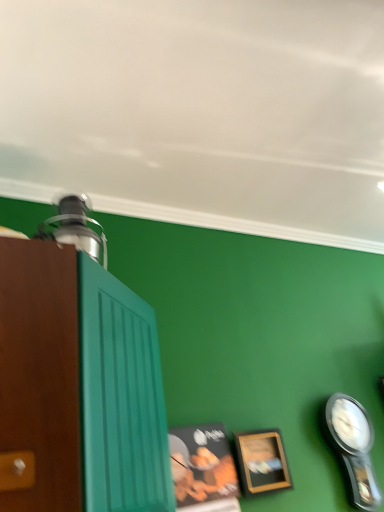
Locate an element on the screen. wooden picture frame at lower right, positioned as the second picture frame in left-to-right order is located at coordinates (262, 462).

Describe the element at coordinates (80, 384) in the screenshot. I see `brown wood cabinet at left` at that location.

What do you see at coordinates (354, 447) in the screenshot? Image resolution: width=384 pixels, height=512 pixels. I see `black plastic clock at lower right` at bounding box center [354, 447].

How much space does wooden picture frame at lower center, the first picture frame in the left-to-right sequence, occupy vertically?

wooden picture frame at lower center, the first picture frame in the left-to-right sequence, is 10.99 inches tall.

Identify the location of wooden picture frame at lower right, positioned as the second picture frame in left-to-right order. The height and width of the screenshot is (512, 384). (262, 462).

Does black plastic clock at lower right come in front of wooden picture frame at lower center, the first picture frame in the left-to-right sequence?

No, black plastic clock at lower right is further to the viewer.

Is black plastic clock at lower right to the left or to the right of wooden picture frame at lower center, the first picture frame in the left-to-right sequence, in the image?

black plastic clock at lower right is to the right of wooden picture frame at lower center, the first picture frame in the left-to-right sequence.

In terms of size, does black plastic clock at lower right appear bigger or smaller than wooden picture frame at lower center, the 2th picture frame in the right-to-left sequence?

black plastic clock at lower right is bigger than wooden picture frame at lower center, the 2th picture frame in the right-to-left sequence.

Would you say black plastic clock at lower right is outside wooden picture frame at lower center, the 2th picture frame in the right-to-left sequence?

black plastic clock at lower right lies outside wooden picture frame at lower center, the 2th picture frame in the right-to-left sequence,'s area.

Could you measure the distance between brown wood cabinet at left and wooden picture frame at lower center, the 2th picture frame in the right-to-left sequence?

brown wood cabinet at left is 57.08 centimeters from wooden picture frame at lower center, the 2th picture frame in the right-to-left sequence.

Can you tell me how much brown wood cabinet at left and wooden picture frame at lower center, the first picture frame in the left-to-right sequence, differ in facing direction?

4.34 degrees.

Which of these two, brown wood cabinet at left or wooden picture frame at lower center, the first picture frame in the left-to-right sequence, stands shorter?

Standing shorter between the two is wooden picture frame at lower center, the first picture frame in the left-to-right sequence.

Does brown wood cabinet at left come behind wooden picture frame at lower center, the 2th picture frame in the right-to-left sequence?

No, brown wood cabinet at left is closer to the viewer.

Is wooden picture frame at lower right, the first picture frame in the right-to-left sequence, outside of wooden picture frame at lower center, the first picture frame in the left-to-right sequence?

wooden picture frame at lower right, the first picture frame in the right-to-left sequence, lies outside wooden picture frame at lower center, the first picture frame in the left-to-right sequence,'s area.

Who is smaller, wooden picture frame at lower right, positioned as the second picture frame in left-to-right order, or wooden picture frame at lower center, the first picture frame in the left-to-right sequence?

wooden picture frame at lower right, positioned as the second picture frame in left-to-right order.

How different are the orientations of wooden picture frame at lower right, positioned as the second picture frame in left-to-right order, and wooden picture frame at lower center, the 2th picture frame in the right-to-left sequence, in degrees?

wooden picture frame at lower right, positioned as the second picture frame in left-to-right order, and wooden picture frame at lower center, the 2th picture frame in the right-to-left sequence, are facing 3.12 degrees away from each other.

In the scene shown: From a real-world perspective, relative to wooden picture frame at lower center, the first picture frame in the left-to-right sequence, is wooden picture frame at lower right, the first picture frame in the right-to-left sequence, vertically above or below?

In terms of real-world spatial position, wooden picture frame at lower right, the first picture frame in the right-to-left sequence, is above wooden picture frame at lower center, the first picture frame in the left-to-right sequence.

Would you consider wooden picture frame at lower right, positioned as the second picture frame in left-to-right order, to be distant from black plastic clock at lower right?

They are positioned close to each other.

Between point (244, 449) and point (373, 435), which one is positioned in front?

The point (244, 449) is closer.

Is wooden picture frame at lower right, the first picture frame in the right-to-left sequence, aimed at black plastic clock at lower right?

No, wooden picture frame at lower right, the first picture frame in the right-to-left sequence, is not oriented towards black plastic clock at lower right.

From the image's perspective, does wooden picture frame at lower right, positioned as the second picture frame in left-to-right order, appear lower than black plastic clock at lower right?

No.

Is wooden picture frame at lower center, the first picture frame in the left-to-right sequence, touching black plastic clock at lower right?

No, wooden picture frame at lower center, the first picture frame in the left-to-right sequence, is not touching black plastic clock at lower right.

Where is `clock behind the wooden picture frame at lower center, the 2th picture frame in the right-to-left sequence`? This screenshot has width=384, height=512. clock behind the wooden picture frame at lower center, the 2th picture frame in the right-to-left sequence is located at coordinates (354, 447).

Could you tell me if wooden picture frame at lower center, the first picture frame in the left-to-right sequence, is turned towards black plastic clock at lower right?

No.

From the image's perspective, relative to brown wood cabinet at left, is black plastic clock at lower right above or below?

Clearly, from the image's perspective, black plastic clock at lower right is below brown wood cabinet at left.

Looking at this image, is the position of black plastic clock at lower right less distant than that of brown wood cabinet at left?

No, it is behind brown wood cabinet at left.

Based on their positions, is black plastic clock at lower right located to the left or right of brown wood cabinet at left?

black plastic clock at lower right is positioned on brown wood cabinet at left's right side.

From the image's perspective, between wooden picture frame at lower right, positioned as the second picture frame in left-to-right order, and brown wood cabinet at left, who is located below?

wooden picture frame at lower right, positioned as the second picture frame in left-to-right order, is shown below in the image.

Which object is closer to the camera taking this photo, wooden picture frame at lower right, positioned as the second picture frame in left-to-right order, or brown wood cabinet at left?

brown wood cabinet at left is more forward.

Is point (267, 438) positioned in front of point (6, 315)?

No, it is behind (6, 315).

In order to click on picture frame that is the 2nd one when counting downward from the brown wood cabinet at left (from the image's perspective) in this screenshot , I will do (262, 462).

From a real-world perspective, starting from the black plastic clock at lower right, which picture frame is the 1st one vertically above it? Please provide its 2D coordinates.

[(203, 468)]

Locate an element on the screen. cabinetry that appears in front of the wooden picture frame at lower center, the first picture frame in the left-to-right sequence is located at coordinates (80, 384).

Which object lies further to the anchor point wooden picture frame at lower center, the first picture frame in the left-to-right sequence, brown wood cabinet at left or black plastic clock at lower right?

brown wood cabinet at left.

Looking at the image, which one is located further to wooden picture frame at lower right, the first picture frame in the right-to-left sequence, black plastic clock at lower right or wooden picture frame at lower center, the first picture frame in the left-to-right sequence?

black plastic clock at lower right.

When comparing their distances from brown wood cabinet at left, does wooden picture frame at lower center, the first picture frame in the left-to-right sequence, or wooden picture frame at lower right, the first picture frame in the right-to-left sequence, seem closer?

The object closer to brown wood cabinet at left is wooden picture frame at lower center, the first picture frame in the left-to-right sequence.

Looking at the image, which one is located closer to wooden picture frame at lower right, the first picture frame in the right-to-left sequence, brown wood cabinet at left or black plastic clock at lower right?

black plastic clock at lower right.

From the image, which object appears to be farther from wooden picture frame at lower center, the first picture frame in the left-to-right sequence, black plastic clock at lower right or brown wood cabinet at left?

brown wood cabinet at left is positioned further to the anchor wooden picture frame at lower center, the first picture frame in the left-to-right sequence.

Estimate the real-world distances between objects in this image. Which object is further from black plastic clock at lower right, wooden picture frame at lower center, the first picture frame in the left-to-right sequence, or brown wood cabinet at left?

brown wood cabinet at left is positioned further to the anchor black plastic clock at lower right.

Estimate the real-world distances between objects in this image. Which object is further from black plastic clock at lower right, brown wood cabinet at left or wooden picture frame at lower right, the first picture frame in the right-to-left sequence?

brown wood cabinet at left lies further to black plastic clock at lower right than the other object.

Estimate the real-world distances between objects in this image. Which object is further from brown wood cabinet at left, wooden picture frame at lower right, the first picture frame in the right-to-left sequence, or wooden picture frame at lower center, the first picture frame in the left-to-right sequence?

wooden picture frame at lower right, the first picture frame in the right-to-left sequence, lies further to brown wood cabinet at left than the other object.

Identify the location of picture frame located between wooden picture frame at lower center, the 2th picture frame in the right-to-left sequence, and black plastic clock at lower right in the left-right direction. The image size is (384, 512). (262, 462).

Identify the location of picture frame located between brown wood cabinet at left and wooden picture frame at lower right, the first picture frame in the right-to-left sequence, in the depth direction. This screenshot has width=384, height=512. (203, 468).